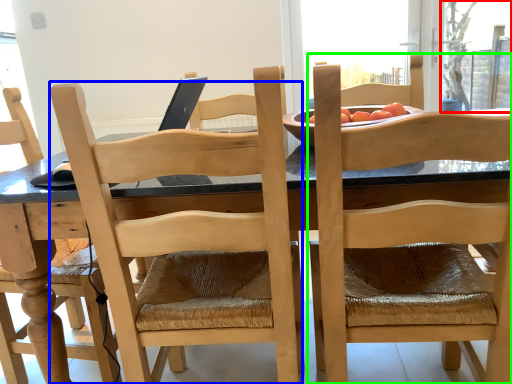
Question: Which is nearer to the window screen (highlighted by a red box)? chair (highlighted by a blue box) or chair (highlighted by a green box).

Choices:
 (A) chair
 (B) chair

Answer: (B)